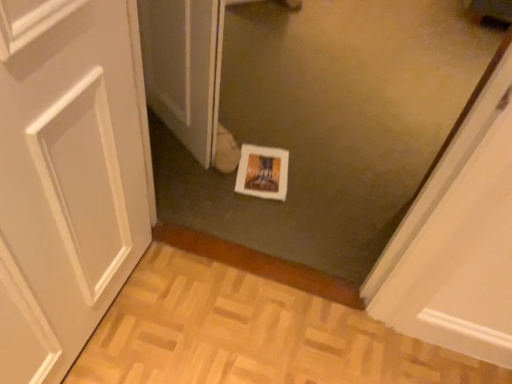
Describe the element at coordinates (184, 68) in the screenshot. I see `white glossy screen door at center` at that location.

Where is `white glossy screen door at center`? This screenshot has height=384, width=512. white glossy screen door at center is located at coordinates (184, 68).

Measure the distance between point (148,42) and camera.

Point (148,42) and camera are 5.53 feet apart from each other.

Image resolution: width=512 pixels, height=384 pixels. I want to click on white glossy print at center, so click(x=263, y=172).

What do you see at coordinates (263, 172) in the screenshot?
I see `white glossy print at center` at bounding box center [263, 172].

The height and width of the screenshot is (384, 512). I want to click on white glossy screen door at center, so click(x=184, y=68).

Between white glossy screen door at center and white glossy print at center, which one appears on the right side from the viewer's perspective?

From the viewer's perspective, white glossy print at center appears more on the right side.

Is the depth of white glossy screen door at center greater than that of white glossy print at center?

No, white glossy screen door at center is closer to the viewer.

Is point (210, 132) closer to viewer compared to point (272, 175)?

Yes.

From the picture: From the image's perspective, which object appears higher, white glossy screen door at center or white glossy print at center?

From the image's view, white glossy screen door at center is above.

From a real-world perspective, is white glossy screen door at center positioned above or below white glossy print at center?

white glossy screen door at center is situated higher than white glossy print at center in the real world.

Looking at this image, considering the sizes of objects white glossy screen door at center and white glossy print at center in the image provided, who is thinner, white glossy screen door at center or white glossy print at center?

Thinner between the two is white glossy screen door at center.

Does white glossy screen door at center have a lesser height compared to white glossy print at center?

No, white glossy screen door at center is not shorter than white glossy print at center.

Between white glossy screen door at center and white glossy print at center, which one has smaller size?

With smaller size is white glossy print at center.

Is white glossy screen door at center situated inside white glossy print at center or outside?

white glossy screen door at center lies outside white glossy print at center.

Is white glossy screen door at center far away from white glossy print at center?

That's not correct — white glossy screen door at center is a little close to white glossy print at center.

Does white glossy screen door at center turn towards white glossy print at center?

No, white glossy screen door at center is not aimed at white glossy print at center.

How many degrees apart are the facing directions of white glossy screen door at center and white glossy print at center?

The angle between the facing direction of white glossy screen door at center and the facing direction of white glossy print at center is 46.7 degrees.

The width and height of the screenshot is (512, 384). In order to click on screen door to the left of white glossy print at center in this screenshot , I will do `click(184, 68)`.

Does white glossy print at center appear on the right side of white glossy screen door at center?

Yes, white glossy print at center is to the right of white glossy screen door at center.

Is white glossy print at center closer to camera compared to white glossy screen door at center?

No, white glossy print at center is further to the viewer.

Considering the points (236, 178) and (204, 74), which point is in front, point (236, 178) or point (204, 74)?

The point (204, 74) is closer to the camera.

From the image's perspective, who appears lower, white glossy print at center or white glossy screen door at center?

white glossy print at center.

From a real-world perspective, who is located higher, white glossy print at center or white glossy screen door at center?

In real-world perspective, white glossy screen door at center is above.

Which object is wider, white glossy print at center or white glossy screen door at center?

With larger width is white glossy print at center.

Can you confirm if white glossy print at center is taller than white glossy screen door at center?

No.

Considering the relative sizes of white glossy print at center and white glossy screen door at center in the image provided, is white glossy print at center bigger than white glossy screen door at center?

Actually, white glossy print at center might be smaller than white glossy screen door at center.

Would you say white glossy print at center is inside or outside white glossy screen door at center?

white glossy print at center is located beyond the bounds of white glossy screen door at center.

Is white glossy print at center in contact with white glossy screen door at center?

No, white glossy print at center is not next to white glossy screen door at center.

Is white glossy print at center oriented away from white glossy screen door at center?

No, white glossy print at center is not facing the opposite direction of white glossy screen door at center.

How many degrees apart are the facing directions of white glossy print at center and white glossy screen door at center?

The angle between the facing direction of white glossy print at center and the facing direction of white glossy screen door at center is 46.7 degrees.

The width and height of the screenshot is (512, 384). I want to click on print behind the white glossy screen door at center, so click(x=263, y=172).

Find the location of a particular element. This screenshot has width=512, height=384. screen door that is above the white glossy print at center (from a real-world perspective) is located at coordinates (184, 68).

Locate an element on the screen. The width and height of the screenshot is (512, 384). print behind the white glossy screen door at center is located at coordinates (263, 172).